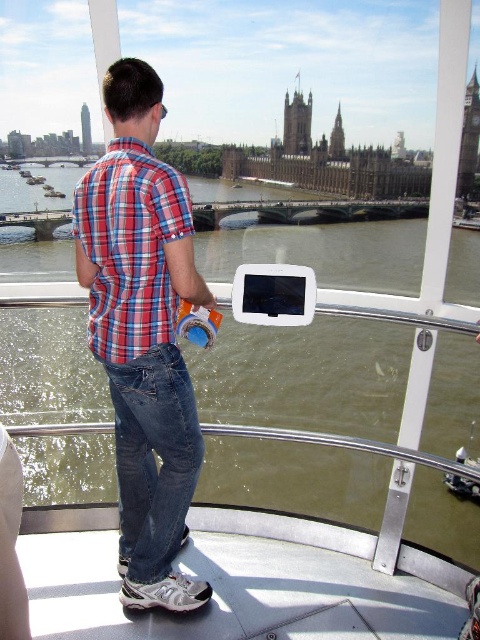
You are standing on the platform with the railing and looking out at the river and city. There are two points marked in the image. Which point is closer to you, point (x=252, y=456) or point (x=108, y=104)?

Point (x=108, y=104) is closer to you because it is in front of point (x=252, y=456).

You are standing at the point marked as point (143, 333) in the image. What object is located exactly at that point?

The plaid cotton shirt at center is located exactly at point (143, 333).